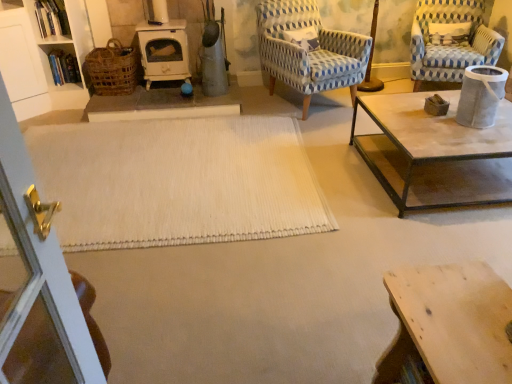
Question: Are blue woven fabric chair at upper right, placed as the second chair when sorted from right to left, and wooden table at lower right located far from each other?

Choices:
 (A) yes
 (B) no

Answer: (A)

Question: From a real-world perspective, is blue woven fabric chair at upper right, which appears as the first chair when viewed from the left, on wooden table at lower right?

Choices:
 (A) no
 (B) yes

Answer: (B)

Question: Is wooden table at lower right at the back of blue woven fabric chair at upper right, placed as the second chair when sorted from right to left?

Choices:
 (A) yes
 (B) no

Answer: (B)

Question: From a real-world perspective, is blue woven fabric chair at upper right, placed as the second chair when sorted from right to left, below wooden table at lower right?

Choices:
 (A) yes
 (B) no

Answer: (B)

Question: Is blue woven fabric chair at upper right, placed as the second chair when sorted from right to left, taller than wooden table at lower right?

Choices:
 (A) no
 (B) yes

Answer: (B)

Question: Looking at their shapes, would you say white woven rug at center is wider or thinner than blue and white checkered fabric armchair at upper right, which is the first chair from right to left?

Choices:
 (A) wide
 (B) thin

Answer: (A)

Question: In terms of size, does white woven rug at center appear bigger or smaller than blue and white checkered fabric armchair at upper right, which is the first chair from right to left?

Choices:
 (A) big
 (B) small

Answer: (B)

Question: From a real-world perspective, is white woven rug at center above or below blue and white checkered fabric armchair at upper right, which is the first chair from right to left?

Choices:
 (A) below
 (B) above

Answer: (A)

Question: From the image's perspective, relative to blue and white checkered fabric armchair at upper right, which is the 2th chair from left to right, is white woven rug at center above or below?

Choices:
 (A) below
 (B) above

Answer: (A)

Question: Considering the positions of blue woven fabric chair at upper right, placed as the second chair when sorted from right to left, and white woven rug at center in the image, is blue woven fabric chair at upper right, placed as the second chair when sorted from right to left, taller or shorter than white woven rug at center?

Choices:
 (A) tall
 (B) short

Answer: (A)

Question: From the image's perspective, is blue woven fabric chair at upper right, which appears as the first chair when viewed from the left, positioned above or below white woven rug at center?

Choices:
 (A) above
 (B) below

Answer: (A)

Question: Looking at the image, does blue woven fabric chair at upper right, placed as the second chair when sorted from right to left, seem bigger or smaller compared to white woven rug at center?

Choices:
 (A) small
 (B) big

Answer: (B)

Question: Visually, is blue woven fabric chair at upper right, placed as the second chair when sorted from right to left, positioned to the left or to the right of white woven rug at center?

Choices:
 (A) right
 (B) left

Answer: (A)

Question: Is white woven rug at center to the left or to the right of woven brown basket at left in the image?

Choices:
 (A) left
 (B) right

Answer: (B)

Question: In the image, is white woven rug at center positioned in front of or behind woven brown basket at left?

Choices:
 (A) front
 (B) behind

Answer: (A)